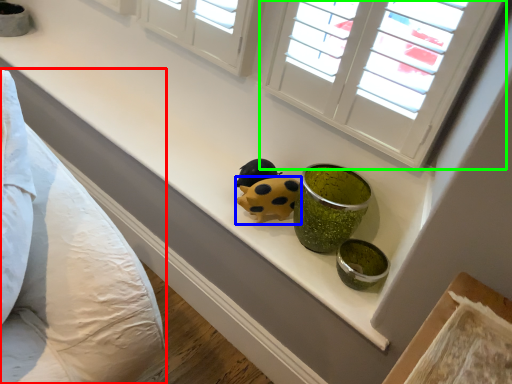
Question: Which object is the farthest from bedding (highlighted by a red box)? Choose among these: ladybug (highlighted by a blue box) or window (highlighted by a green box).

Choices:
 (A) ladybug
 (B) window

Answer: (B)